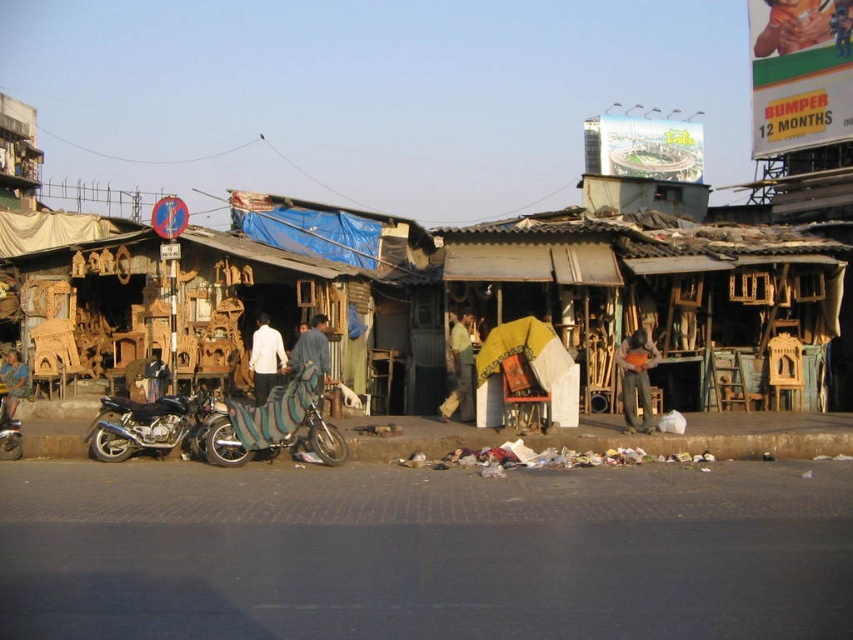
You are a photographer standing at the center of the street. You want to take a photo that includes both the point at coordinates point (122,440) and point (15,458). Which point should you focus on first to ensure both are in sharp focus?

You should focus on point (122,440) first because it is closer to the camera than point (15,458). This ensures that both points will be within the depth of field and in focus.